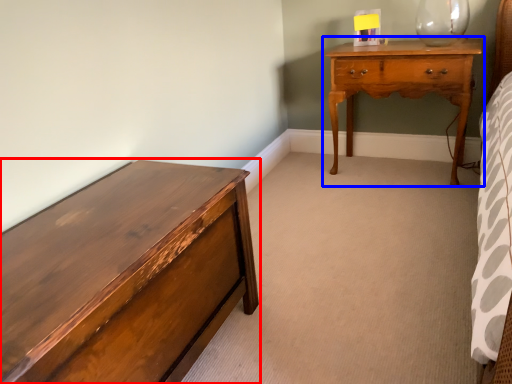
Question: Which object appears farthest to the camera in this image, chest of drawers (highlighted by a red box) or nightstand (highlighted by a blue box)?

Choices:
 (A) chest of drawers
 (B) nightstand

Answer: (B)